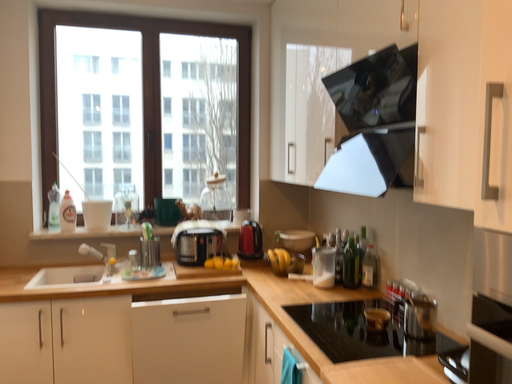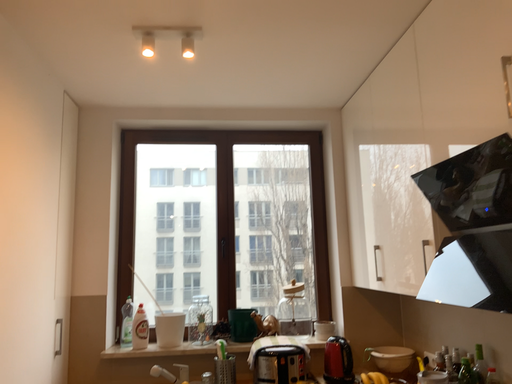
Question: Which way did the camera rotate in the video?

Choices:
 (A) rotated left
 (B) rotated right

Answer: (A)